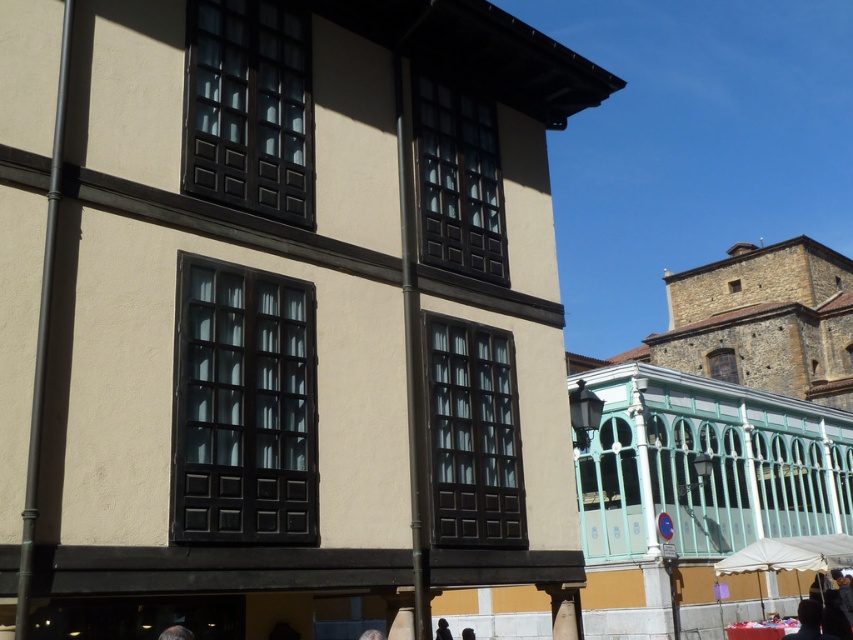
Which is more to the right, black fabric at center or blue denim jeans at lower center?

From the viewer's perspective, black fabric at center appears more on the right side.

Can you confirm if black fabric at center is positioned above blue denim jeans at lower center?

No.

Image resolution: width=853 pixels, height=640 pixels. What are the coordinates of `black fabric at center` in the screenshot? It's located at (442, 628).

Looking at this image, is gray hair at lower left to the left of black hair at center from the viewer's perspective?

Indeed, gray hair at lower left is positioned on the left side of black hair at center.

Is point (163, 636) behind point (468, 627)?

No, (163, 636) is closer to viewer.

Is point (171, 625) in front of point (463, 637)?

Yes, it is.

Where is `gray hair at lower left`? gray hair at lower left is located at coordinates (177, 632).

Between black fabric at center and black hair at center, which one appears on the left side from the viewer's perspective?

black fabric at center is more to the left.

Does point (450, 636) come in front of point (467, 628)?

Yes, point (450, 636) is closer to viewer.

What do you see at coordinates (442, 628) in the screenshot? The height and width of the screenshot is (640, 853). I see `black fabric at center` at bounding box center [442, 628].

Find the location of a particular element. This screenshot has width=853, height=640. black fabric at center is located at coordinates (442, 628).